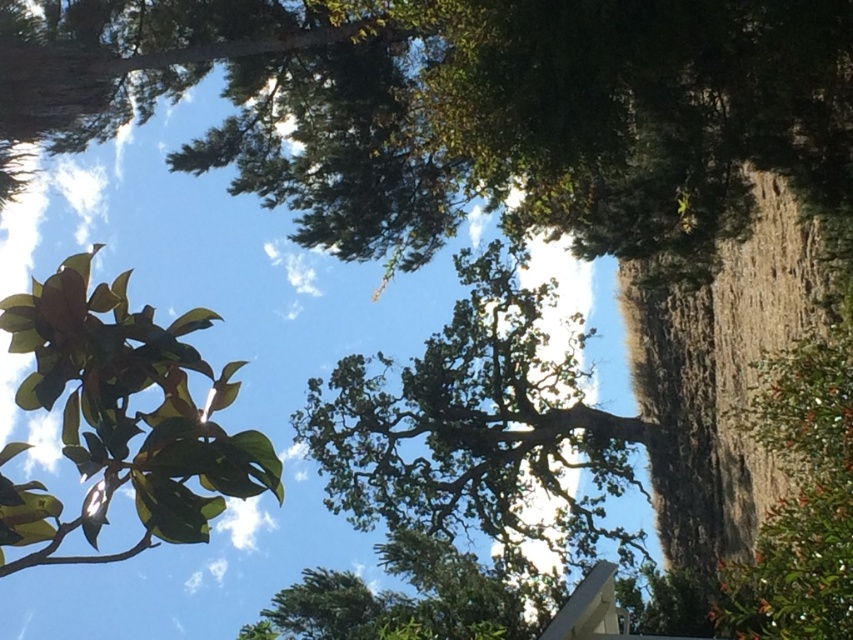
You are standing under the trees looking up at the sky. There is a point marked at coordinates (x=123, y=419). Which object from the scene is located at that point?

The green glossy leaves at upper left are located at point (x=123, y=419).

Based on the photo, you are standing under the trees looking up at the sky. There are two points marked in the scene, point (598, 538) and point (167, 538). Which point is closer to your eyes?

Point (598, 538) is further to the camera than point (167, 538), so the point closer to your eyes is point (167, 538).

Based on the scene description, where is the green leafy tree at center located in terms of coordinates?

The green leafy tree at center is located at coordinates point (474,424).